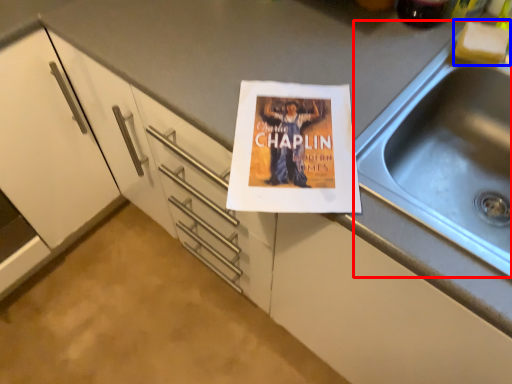
Question: Which point is closer to the camera, sink (highlighted by a red box) or food (highlighted by a blue box)?

Choices:
 (A) sink
 (B) food

Answer: (A)